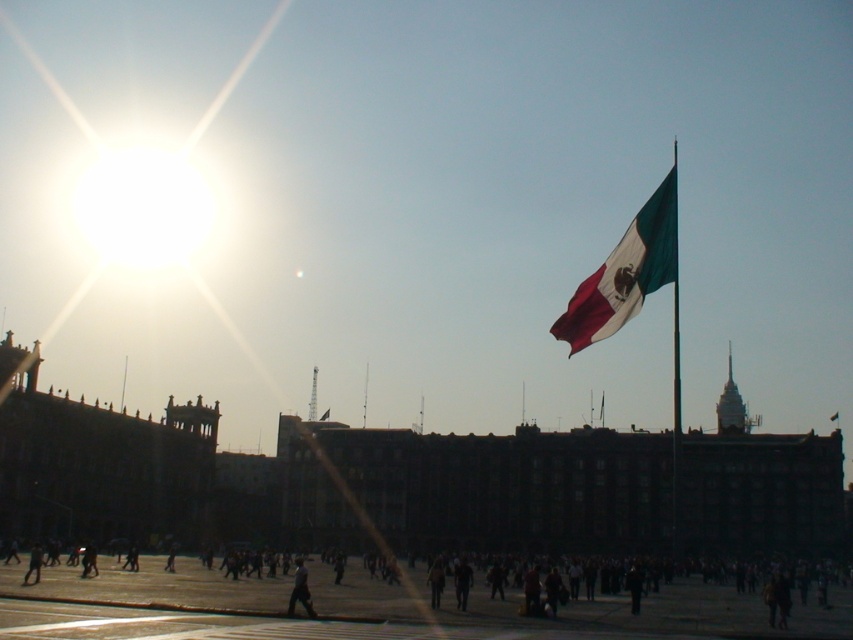
Does dark clothing at center appear under textured cotton flag at upper right?

Correct, dark clothing at center is located below textured cotton flag at upper right.

Looking at this image, does dark clothing at center have a lesser width compared to textured cotton flag at upper right?

No.

Which is in front, point (45, 579) or point (643, 292)?

Point (643, 292) is more forward.

Locate an element on the screen. dark clothing at center is located at coordinates (369, 608).

Consider the image. Does dark clothing at center have a lesser width compared to dark gray fabric person at center?

Incorrect, dark clothing at center's width is not less than dark gray fabric person at center's.

At what (x,y) coordinates should I click in order to perform the action: click on dark clothing at center. Please return your answer as a coordinate pair (x, y). This screenshot has width=853, height=640. Looking at the image, I should click on (369, 608).

Is the position of textured cotton flag at upper right less distant than that of dark gray fabric person at center?

Yes, textured cotton flag at upper right is in front of dark gray fabric person at center.

Who is positioned more to the right, textured cotton flag at upper right or dark gray fabric person at center?

Answer: textured cotton flag at upper right

Find the location of a particular element. Image resolution: width=853 pixels, height=640 pixels. textured cotton flag at upper right is located at coordinates [625, 273].

Locate an element on the screen. This screenshot has width=853, height=640. textured cotton flag at upper right is located at coordinates (625, 273).